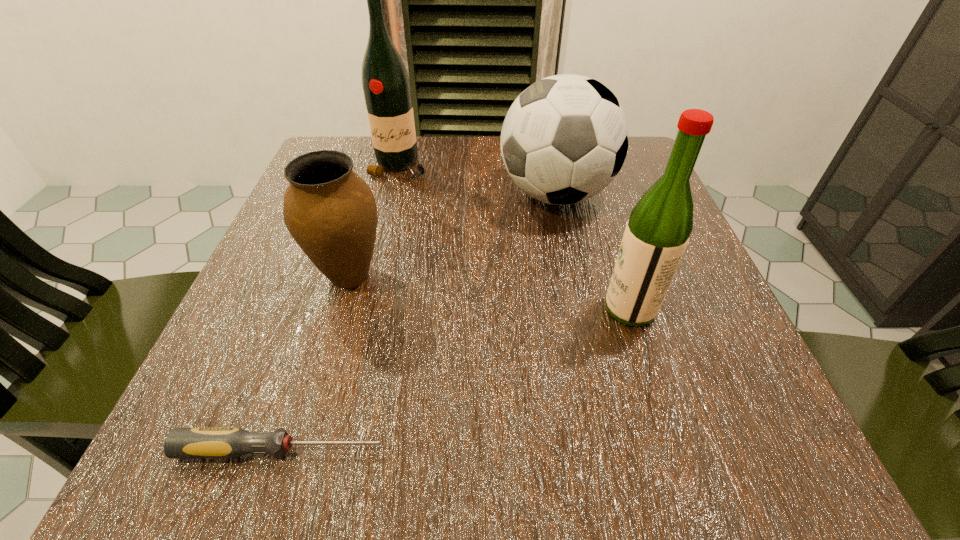
Where is `empty space between the liquor and the urn`? The width and height of the screenshot is (960, 540). empty space between the liquor and the urn is located at coordinates (490, 292).

This screenshot has width=960, height=540. I want to click on vacant space in between the liquor and the urn, so click(x=490, y=292).

Locate an element on the screen. object that stands as the second closest to the liquor is located at coordinates (330, 211).

Identify which object is located as the third nearest to the liquor. Please provide its 2D coordinates. Your answer should be formatted as a tuple, i.e. [(x, y)], where the tuple contains the x and y coordinates of a point satisfying the conditions above.

[(229, 442)]

You are a GUI agent. You are given a task and a screenshot of the screen. Output one action in this format:
    pyautogui.click(x=<x>, y=<y>)
    Task: Click on the free spot that satisfies the following two spatial constraints: 1. on the surface of the wine bottle; 2. insert the screwdriver into a screw head
    The image size is (960, 540).
    Given the screenshot: What is the action you would take?
    pyautogui.click(x=329, y=449)

Where is `blank area in the image that satisfies the following two spatial constraints: 1. on the surface of the wine bottle; 2. insert the screwdriver into a screw head`? The width and height of the screenshot is (960, 540). blank area in the image that satisfies the following two spatial constraints: 1. on the surface of the wine bottle; 2. insert the screwdriver into a screw head is located at coordinates (329, 449).

Locate an element on the screen. The width and height of the screenshot is (960, 540). vacant space that satisfies the following two spatial constraints: 1. on the surface of the wine bottle; 2. insert the shortest object into a screw head is located at coordinates (329, 449).